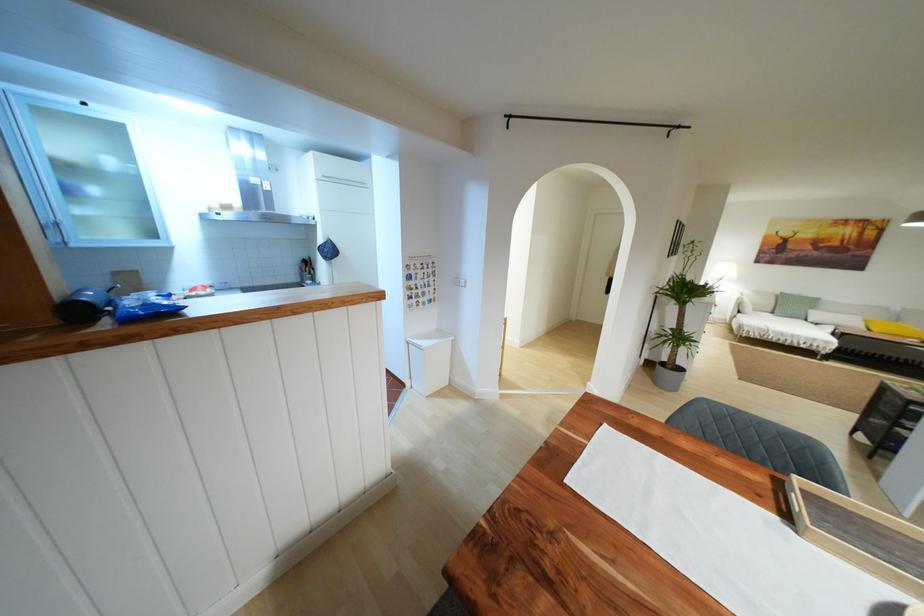
I want to click on grey plant pot, so click(x=669, y=377).